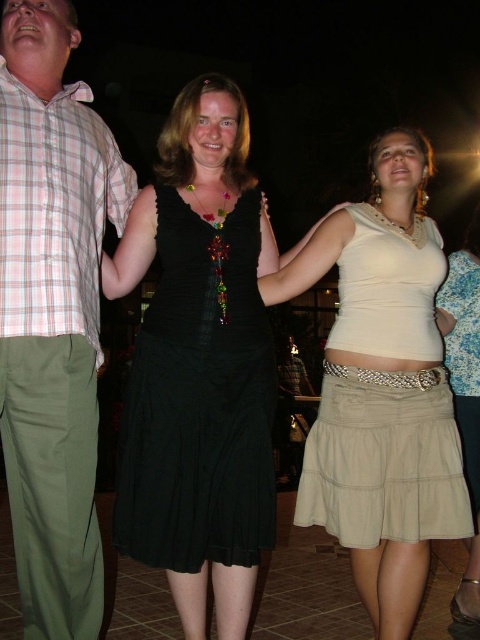
Looking at this image, can you confirm if black satin dress at center is bigger than beige cotton skirt at lower right?

No, black satin dress at center is not bigger than beige cotton skirt at lower right.

Between black satin dress at center and beige cotton skirt at lower right, which one appears on the right side from the viewer's perspective?

From the viewer's perspective, beige cotton skirt at lower right appears more on the right side.

Between point (236, 280) and point (474, 360), which one is positioned in front?

Point (236, 280) is in front.

Locate an element on the screen. The height and width of the screenshot is (640, 480). black satin dress at center is located at coordinates (199, 400).

Does plaid cotton shirt at left appear on the left side of pink plaid shirt at left?

In fact, plaid cotton shirt at left is to the right of pink plaid shirt at left.

Is plaid cotton shirt at left positioned before pink plaid shirt at left?

No, it is behind pink plaid shirt at left.

Measure the distance between point (x=33, y=99) and camera.

The distance of point (x=33, y=99) from camera is 2.95 meters.

The width and height of the screenshot is (480, 640). Find the location of `plaid cotton shirt at left`. plaid cotton shirt at left is located at coordinates (52, 314).

Is plaid cotton shirt at left bigger than black satin dress at center?

Correct, plaid cotton shirt at left is larger in size than black satin dress at center.

Measure the distance between point (23,346) and camera.

Point (23,346) is 2.85 meters away from camera.

You are a GUI agent. You are given a task and a screenshot of the screen. Output one action in this format:
    pyautogui.click(x=<x>, y=<y>)
    Task: Click on the plaid cotton shirt at left
    This screenshot has width=480, height=640.
    Given the screenshot: What is the action you would take?
    click(x=52, y=314)